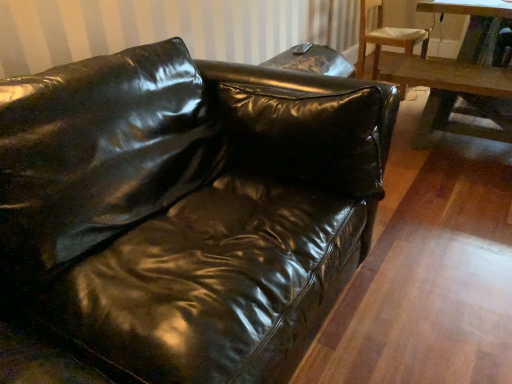
Question: Considering the relative positions of wooden chair at upper right and wooden table at right in the image provided, is wooden chair at upper right to the left of wooden table at right from the viewer's perspective?

Choices:
 (A) no
 (B) yes

Answer: (B)

Question: Does wooden chair at upper right have a greater height compared to wooden table at right?

Choices:
 (A) no
 (B) yes

Answer: (B)

Question: From the image's perspective, is wooden chair at upper right on top of wooden table at right?

Choices:
 (A) no
 (B) yes

Answer: (B)

Question: Can you confirm if wooden chair at upper right is bigger than wooden table at right?

Choices:
 (A) no
 (B) yes

Answer: (A)

Question: Is wooden chair at upper right smaller than wooden table at right?

Choices:
 (A) yes
 (B) no

Answer: (A)

Question: Based on their positions, is wooden chair at upper right located to the left or right of wooden table at right?

Choices:
 (A) right
 (B) left

Answer: (B)

Question: Do you think wooden chair at upper right is within wooden table at right, or outside of it?

Choices:
 (A) inside
 (B) outside

Answer: (B)

Question: From the image's perspective, is wooden chair at upper right above or below wooden table at right?

Choices:
 (A) above
 (B) below

Answer: (A)

Question: Is wooden chair at upper right wider or thinner than wooden table at right?

Choices:
 (A) thin
 (B) wide

Answer: (B)

Question: Is glossy leather couch at center to the left or to the right of wooden table at right in the image?

Choices:
 (A) right
 (B) left

Answer: (B)

Question: Looking at their shapes, would you say glossy leather couch at center is wider or thinner than wooden table at right?

Choices:
 (A) wide
 (B) thin

Answer: (A)

Question: Is glossy leather couch at center taller or shorter than wooden table at right?

Choices:
 (A) tall
 (B) short

Answer: (B)

Question: From the image's perspective, is glossy leather couch at center positioned above or below wooden table at right?

Choices:
 (A) above
 (B) below

Answer: (B)

Question: Considering the positions of wooden table at right and glossy leather couch at center in the image, is wooden table at right wider or thinner than glossy leather couch at center?

Choices:
 (A) thin
 (B) wide

Answer: (A)

Question: Choose the correct answer: Is wooden table at right inside glossy leather couch at center or outside it?

Choices:
 (A) inside
 (B) outside

Answer: (B)